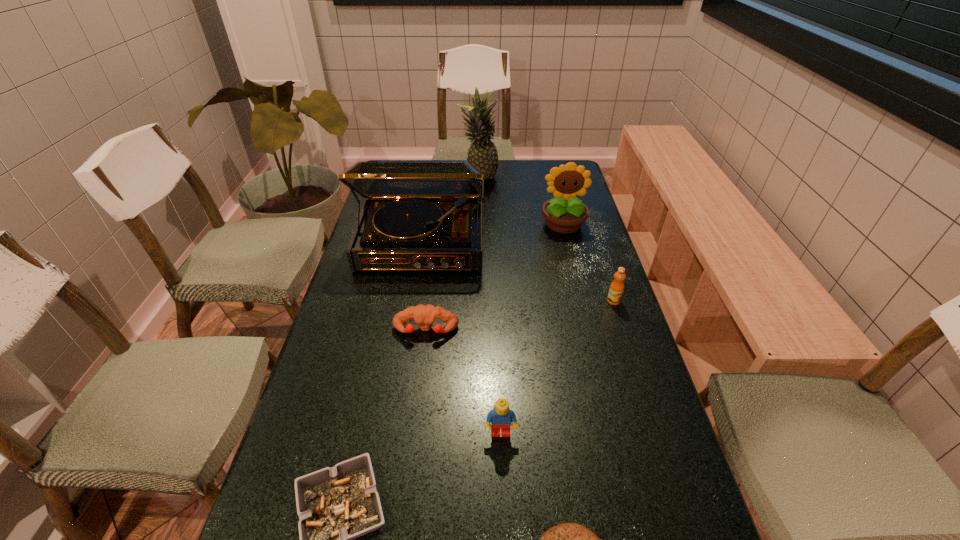
The width and height of the screenshot is (960, 540). Find the location of `vacant region between the third nearest object and the record player`. vacant region between the third nearest object and the record player is located at coordinates (461, 339).

The width and height of the screenshot is (960, 540). In order to click on free space that is in between the third nearest object and the pineapple in this screenshot , I will do `click(490, 306)`.

The height and width of the screenshot is (540, 960). In order to click on free space between the Lego and the record player in this screenshot , I will do `click(461, 339)`.

You are a GUI agent. You are given a task and a screenshot of the screen. Output one action in this format:
    pyautogui.click(x=<x>, y=<y>)
    Task: Click on the free space between the third nearest object and the record player
    The image size is (960, 540).
    Given the screenshot: What is the action you would take?
    pyautogui.click(x=461, y=339)

Where is `free spot between the third tallest object and the puncher`? The width and height of the screenshot is (960, 540). free spot between the third tallest object and the puncher is located at coordinates (494, 278).

At what (x,y) coordinates should I click in order to perform the action: click on object that is the sixth nearest to the puncher. Please return your answer as a coordinate pair (x, y). Looking at the image, I should click on (566, 539).

Locate an element on the screen. Image resolution: width=960 pixels, height=540 pixels. object that is the fourth closest one to the third tallest object is located at coordinates (424, 316).